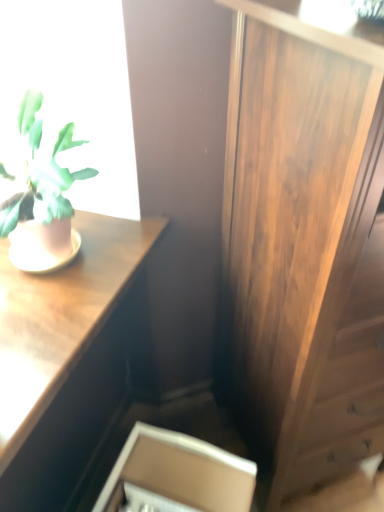
Question: Would you say matte pink pot at left is inside or outside wooden side cabinet at right?

Choices:
 (A) inside
 (B) outside

Answer: (B)

Question: Considering the positions of matte pink pot at left and wooden side cabinet at right in the image, is matte pink pot at left taller or shorter than wooden side cabinet at right?

Choices:
 (A) tall
 (B) short

Answer: (B)

Question: Which object is positioned closest to the pink matte flowerpot at left?

Choices:
 (A) wooden desk at upper left
 (B) wooden side cabinet at right
 (C) white cardboard box at lower center
 (D) matte pink pot at left

Answer: (D)

Question: Considering the real-world distances, which object is farthest from the pink matte flowerpot at left?

Choices:
 (A) wooden desk at upper left
 (B) wooden side cabinet at right
 (C) white cardboard box at lower center
 (D) matte pink pot at left

Answer: (B)